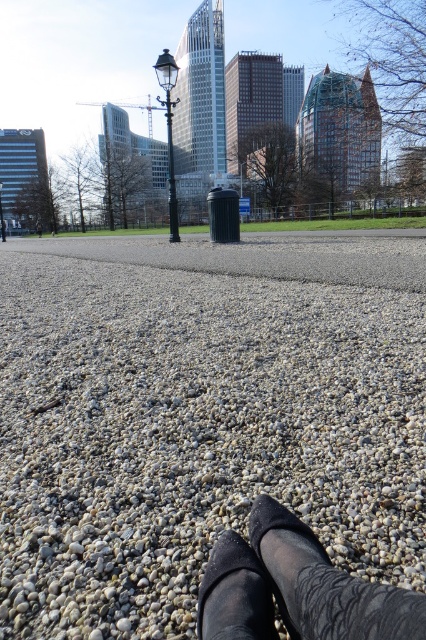
Can you confirm if gray pebbled gravel at center is positioned to the left of black fabric shoes at center?

Yes, gray pebbled gravel at center is to the left of black fabric shoes at center.

Can you confirm if gray pebbled gravel at center is shorter than black fabric shoes at center?

In fact, gray pebbled gravel at center may be taller than black fabric shoes at center.

Is point (115, 563) behind point (222, 596)?

Yes, point (115, 563) is behind point (222, 596).

Locate an element on the screen. The width and height of the screenshot is (426, 640). gray pebbled gravel at center is located at coordinates (195, 435).

Does point (245, 584) come farther from viewer compared to point (229, 580)?

No, it is in front of (229, 580).

Find the location of a particular element. The image size is (426, 640). black fabric shoes at center is located at coordinates (296, 588).

The image size is (426, 640). In order to click on black fabric shoes at center in this screenshot , I will do `click(296, 588)`.

Identify the location of black fabric shoes at center. This screenshot has height=640, width=426. (296, 588).

Does gray pebbled gravel at center have a lesser width compared to black suede shoe at lower center?

No, gray pebbled gravel at center is not thinner than black suede shoe at lower center.

Does gray pebbled gravel at center appear under black suede shoe at lower center?

No, gray pebbled gravel at center is not below black suede shoe at lower center.

Is point (331, 444) closer to camera compared to point (275, 628)?

That is False.

At what (x,y) coordinates should I click in order to perform the action: click on gray pebbled gravel at center. Please return your answer as a coordinate pair (x, y). The width and height of the screenshot is (426, 640). Looking at the image, I should click on (195, 435).